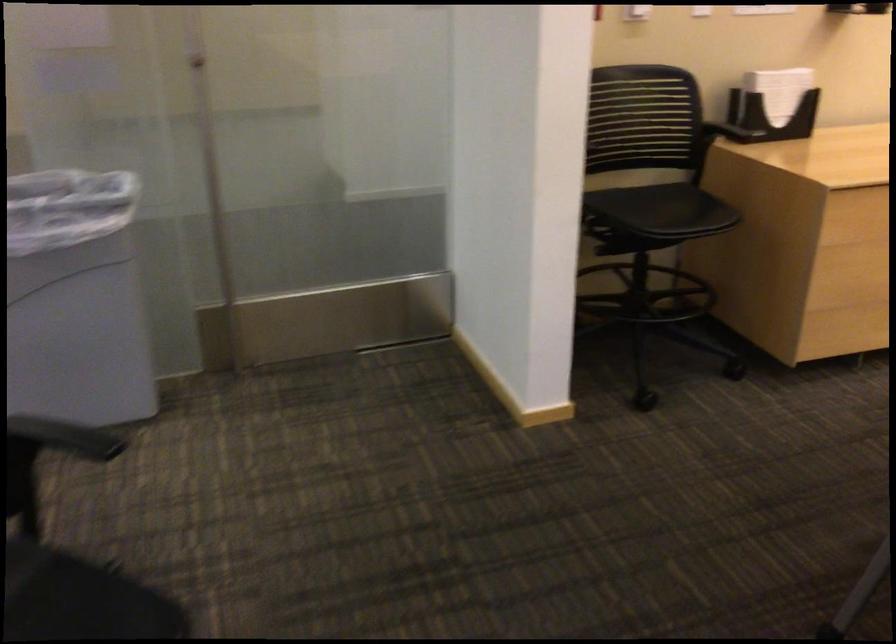
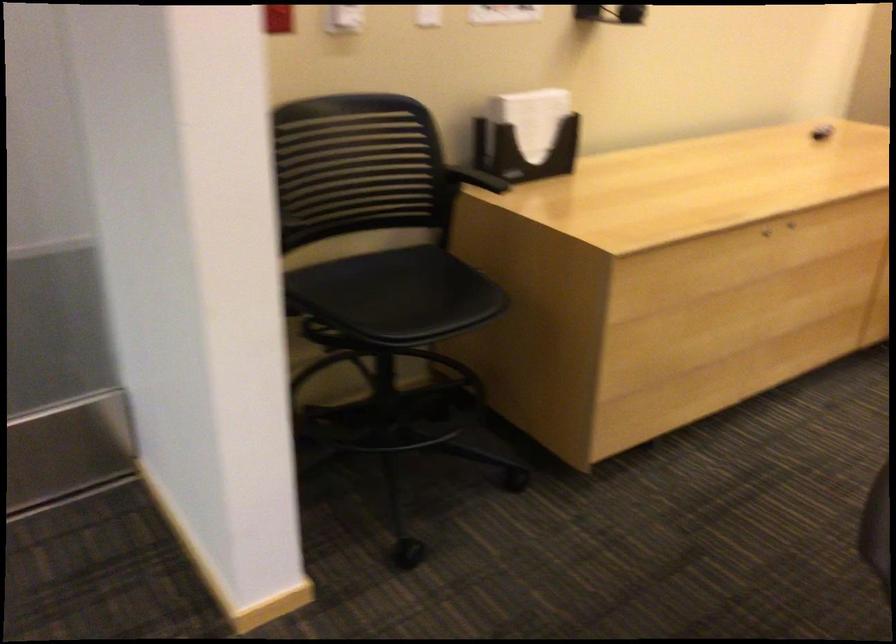
Where in the second image is the point corresponding to [780,84] from the first image?

(531, 118)